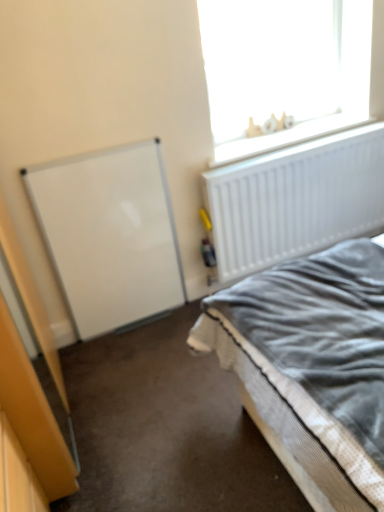
Question: In terms of size, does white plastic letters at upper right appear bigger or smaller than white matte love sign at upper right?

Choices:
 (A) big
 (B) small

Answer: (B)

Question: Choose the correct answer: Is white plastic letters at upper right inside white matte love sign at upper right or outside it?

Choices:
 (A) outside
 (B) inside

Answer: (A)

Question: Estimate the real-world distances between objects in this image. Which object is closer to the white plastic letters at upper right?

Choices:
 (A) white matte love sign at upper right
 (B) textured gray bed at lower right

Answer: (A)

Question: Which of these objects is positioned closest to the white matte love sign at upper right?

Choices:
 (A) textured gray bed at lower right
 (B) white plastic letters at upper right

Answer: (B)